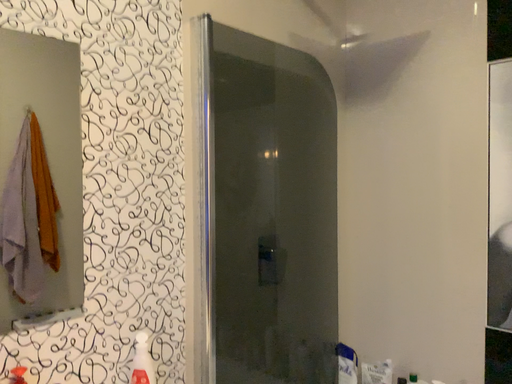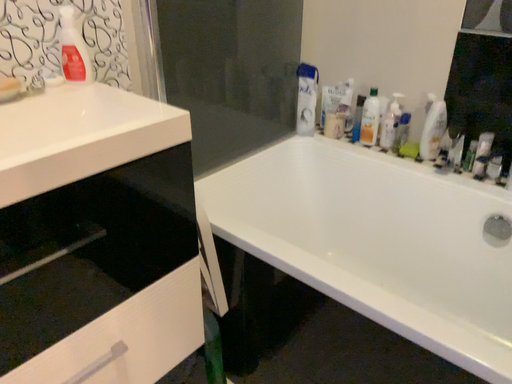
Question: Which way did the camera rotate in the video?

Choices:
 (A) rotated downward
 (B) rotated upward

Answer: (A)